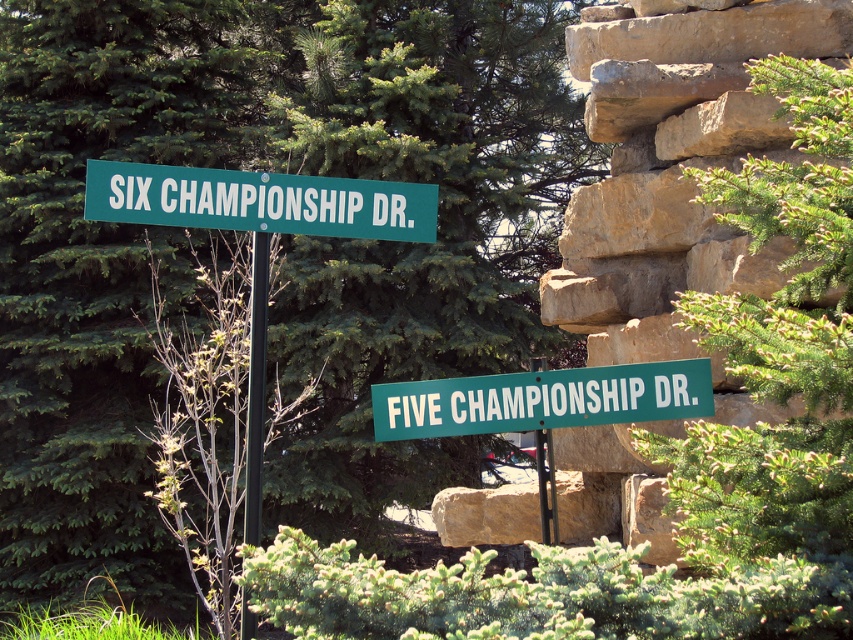
Question: Is green leafy tree at upper center in front of green plastic street sign at center?

Choices:
 (A) no
 (B) yes

Answer: (A)

Question: Which of the following is the closest to the observer?

Choices:
 (A) green plastic pole at center
 (B) green leafy tree at upper center
 (C) black metal pole at center

Answer: (C)

Question: Observing the image, what is the correct spatial positioning of green leafy tree at upper center in reference to green plastic street sign at upper center?

Choices:
 (A) above
 (B) below

Answer: (A)

Question: Which point is farther from the camera taking this photo?

Choices:
 (A) (610, 388)
 (B) (254, 444)
 (C) (328, 209)

Answer: (C)

Question: Is green leafy tree at upper center wider than green plastic street sign at upper center?

Choices:
 (A) yes
 (B) no

Answer: (A)

Question: Which point appears closest to the camera in this image?

Choices:
 (A) (570, 387)
 (B) (538, 508)

Answer: (A)